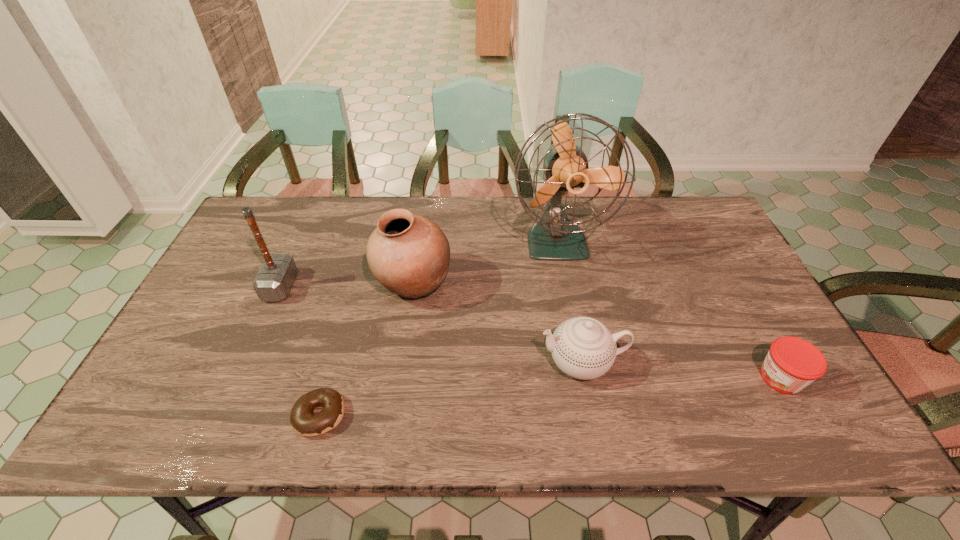
This screenshot has height=540, width=960. I want to click on the tallest object, so click(x=554, y=237).

Find the location of a particular element. the leftmost object is located at coordinates (273, 282).

Find the location of a particular element. pottery is located at coordinates (408, 254).

Locate an element on the screen. the third shortest object is located at coordinates (584, 348).

This screenshot has height=540, width=960. I want to click on the rightmost object, so coord(792,363).

Where is `the fifth tallest object`? Image resolution: width=960 pixels, height=540 pixels. the fifth tallest object is located at coordinates tap(792, 363).

Where is `the shortest object`? the shortest object is located at coordinates (302, 418).

Where is `vacant region located on the front-facing side of the fan for air flow`? vacant region located on the front-facing side of the fan for air flow is located at coordinates (579, 350).

You are a GUI agent. You are given a task and a screenshot of the screen. Output one action in this format:
    pyautogui.click(x=<x>, y=<y>)
    Task: Click on the vacant space located on the striking surface of the leftmost object
    The width and height of the screenshot is (960, 540).
    Given the screenshot: What is the action you would take?
    pyautogui.click(x=377, y=287)

Where is `vacant space located on the left of the pottery`? vacant space located on the left of the pottery is located at coordinates (292, 284).